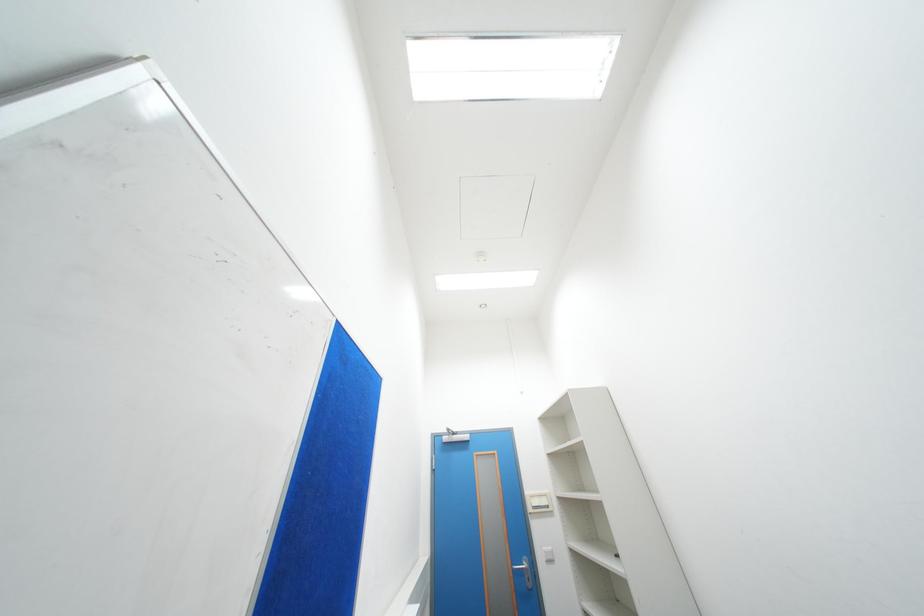
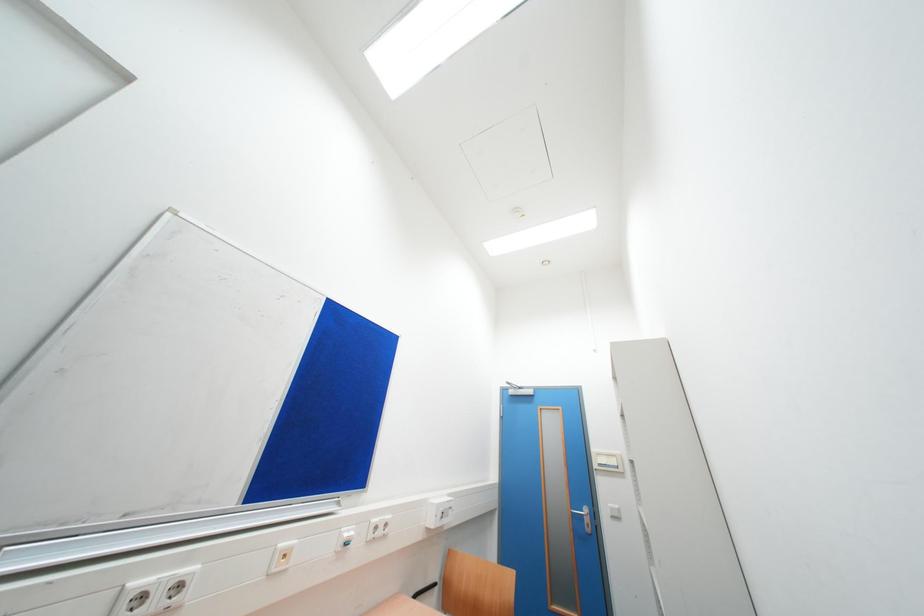
Question: How did the camera likely rotate?

Choices:
 (A) Left
 (B) Right
 (C) Up
 (D) Down

Answer: (A)